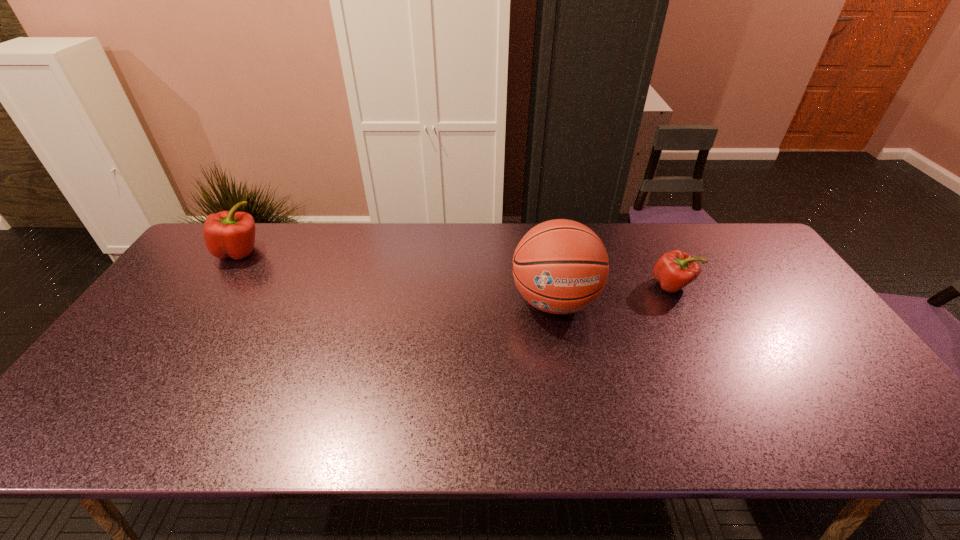
The image size is (960, 540). Find the location of `object present at the left edge`. object present at the left edge is located at coordinates (231, 234).

This screenshot has height=540, width=960. I want to click on object located in the far left corner section of the desktop, so click(231, 234).

In the image, there is a desktop. Where is `vacant space at the far edge`? The width and height of the screenshot is (960, 540). vacant space at the far edge is located at coordinates pyautogui.click(x=435, y=239).

Image resolution: width=960 pixels, height=540 pixels. In the image, there is a desktop. In order to click on vacant space at the near edge in this screenshot , I will do `click(532, 426)`.

This screenshot has width=960, height=540. Identify the location of blank space at the left edge of the desktop. (225, 276).

The image size is (960, 540). I want to click on free space at the right edge of the desktop, so click(814, 325).

Where is `vacant space at the near left corner of the desktop`? vacant space at the near left corner of the desktop is located at coordinates (91, 441).

Where is `free region at the far right corner of the desktop`? This screenshot has width=960, height=540. free region at the far right corner of the desktop is located at coordinates (738, 245).

In order to click on free space between the second shortest object and the basketball in this screenshot , I will do `click(397, 276)`.

Identify the location of unoccupied area between the nearer bell pepper and the farther bell pepper. (x=456, y=268).